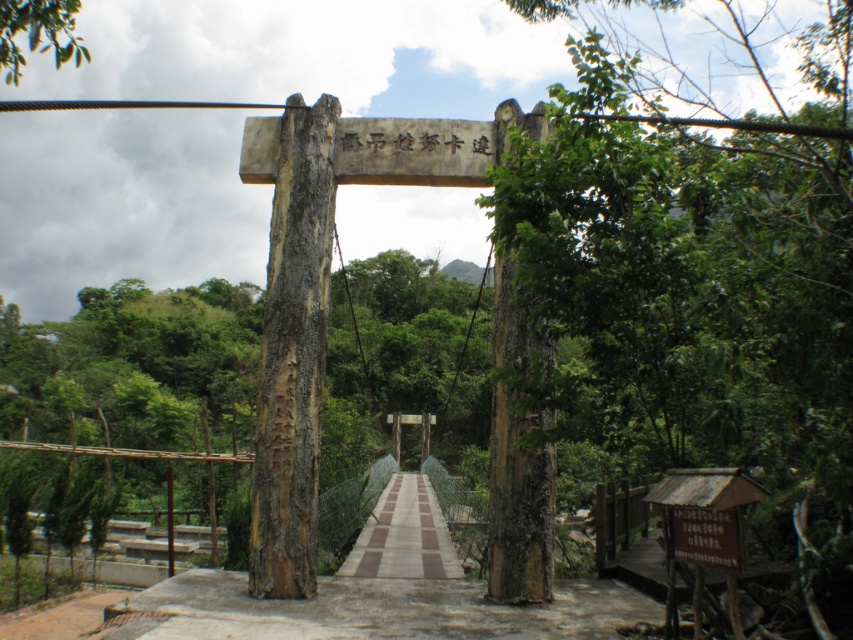
You are a hiker carrying a large backpack and need to cross the bridge. You notice the brown concrete path at center and the brown wooden sign at center. Which one is wider so you can choose the safer path?

The brown concrete path at center is wider than the brown wooden sign at center, so the concrete path is the safer option for crossing.

You are standing at the entrance of the rustic wooden suspension bridge and see the brown concrete path at center and the brown wooden sign at center. Which object is taller?

The brown concrete path at center is much taller than the brown wooden sign at center.